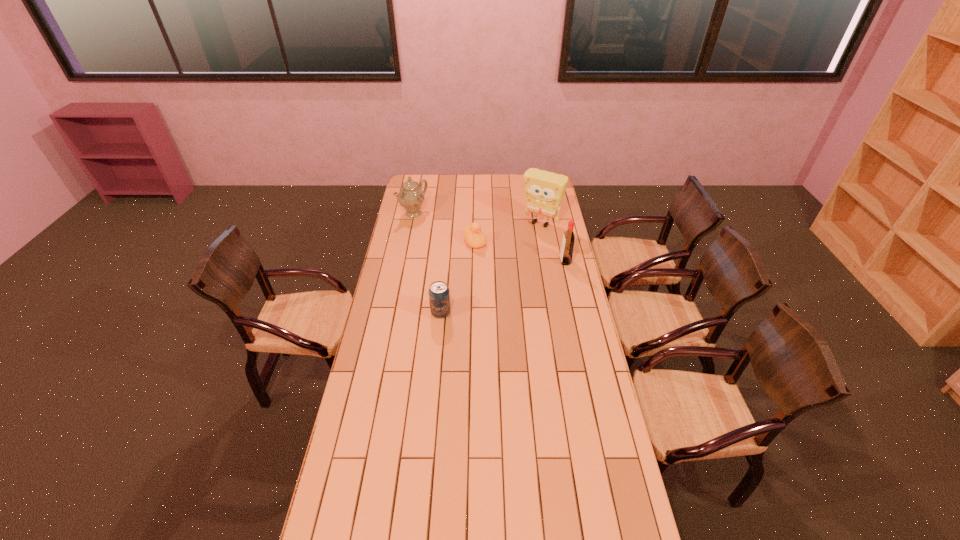
The image size is (960, 540). What are the coordinates of `vacant space that satisfies the following two spatial constraints: 1. on the front side of the leftmost object; 2. on the right side of the nearest object` in the screenshot? It's located at (394, 313).

Where is `vacant position in the image that satisfies the following two spatial constraints: 1. on the front side of the third nearest object; 2. on the left side of the chinaware`? This screenshot has width=960, height=540. vacant position in the image that satisfies the following two spatial constraints: 1. on the front side of the third nearest object; 2. on the left side of the chinaware is located at coordinates (408, 242).

The width and height of the screenshot is (960, 540). I want to click on vacant space that satisfies the following two spatial constraints: 1. on the back side of the pop soda; 2. on the left side of the third object from left to right, so click(447, 242).

I want to click on free region that satisfies the following two spatial constraints: 1. on the front side of the second nearest object; 2. on the front and back of the shortest object, so click(474, 261).

You are a GUI agent. You are given a task and a screenshot of the screen. Output one action in this format:
    pyautogui.click(x=<x>, y=<y>)
    Task: Click on the free space that satisfies the following two spatial constraints: 1. on the front side of the fourth farthest object; 2. on the front and back of the leftmost object
    The image size is (960, 540).
    Given the screenshot: What is the action you would take?
    pyautogui.click(x=404, y=261)

Where is `free spot that satisfies the following two spatial constraints: 1. on the front side of the third object from left to right; 2. on the right side of the chinaware`? This screenshot has height=540, width=960. free spot that satisfies the following two spatial constraints: 1. on the front side of the third object from left to right; 2. on the right side of the chinaware is located at coordinates (408, 242).

Where is `vacant space that satisfies the following two spatial constraints: 1. on the front side of the vodka; 2. on the front and back of the duck`? The image size is (960, 540). vacant space that satisfies the following two spatial constraints: 1. on the front side of the vodka; 2. on the front and back of the duck is located at coordinates (474, 261).